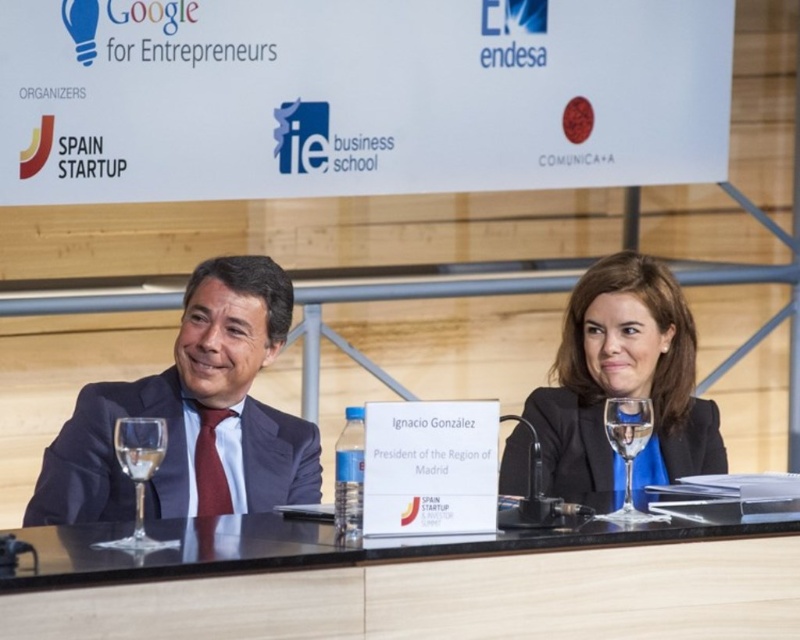
Does black glossy suit at center appear over clear glass wine glass at center?

Yes.

Identify the location of black glossy suit at center. pyautogui.click(x=624, y=384).

Does point (520, 486) lie behind point (632, 406)?

Yes.

This screenshot has width=800, height=640. In order to click on black glossy suit at center in this screenshot , I will do `click(624, 384)`.

Based on the photo, between dark blue suit at left and black matte business suit at center, which one has more height?

dark blue suit at left

Can you confirm if dark blue suit at left is positioned below black matte business suit at center?

Actually, dark blue suit at left is above black matte business suit at center.

What do you see at coordinates (192, 416) in the screenshot? I see `dark blue suit at left` at bounding box center [192, 416].

Find the location of a particular element. This screenshot has width=800, height=640. dark blue suit at left is located at coordinates [x=192, y=416].

Describe the element at coordinates (572, 445) in the screenshot. I see `black matte business suit at center` at that location.

Can you confirm if black matte business suit at center is wider than clear glass wine glass at center?

Indeed, black matte business suit at center has a greater width compared to clear glass wine glass at center.

Is point (708, 461) positioned in front of point (625, 467)?

No.

What are the coordinates of `black matte business suit at center` in the screenshot? It's located at (572, 445).